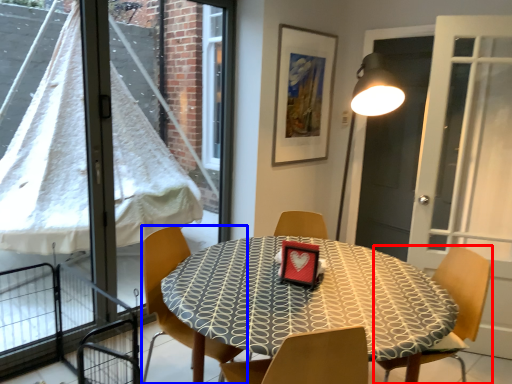
Question: Among these objects, which one is nearest to the camera, chair (highlighted by a red box) or chair (highlighted by a blue box)?

Choices:
 (A) chair
 (B) chair

Answer: (A)